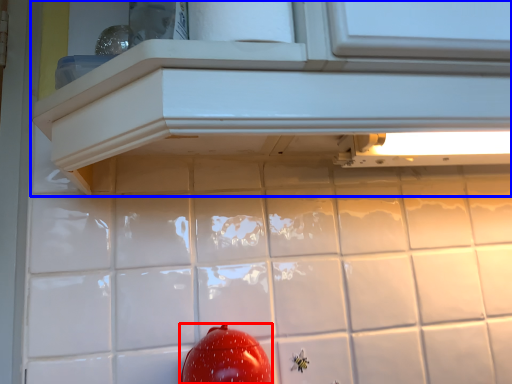
Question: Which object is further to the camera taking this photo, tomato (highlighted by a red box) or cabinetry (highlighted by a blue box)?

Choices:
 (A) tomato
 (B) cabinetry

Answer: (A)